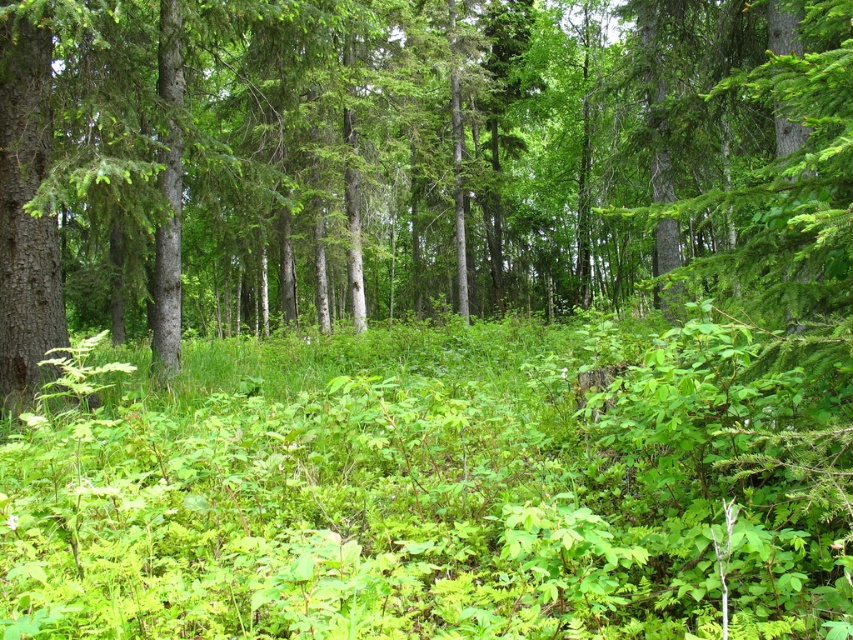
Is point (346, 308) positioned before point (564, 611)?

That is False.

In order to click on green matte tree at center in this screenshot , I will do click(413, 163).

I want to click on green matte tree at center, so click(413, 163).